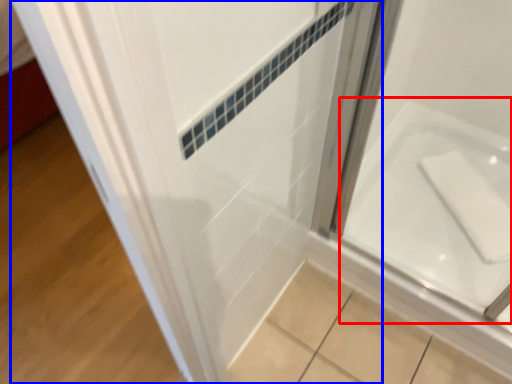
Question: Which object appears closest to the camera in this image, bath (highlighted by a red box) or door (highlighted by a blue box)?

Choices:
 (A) bath
 (B) door

Answer: (B)